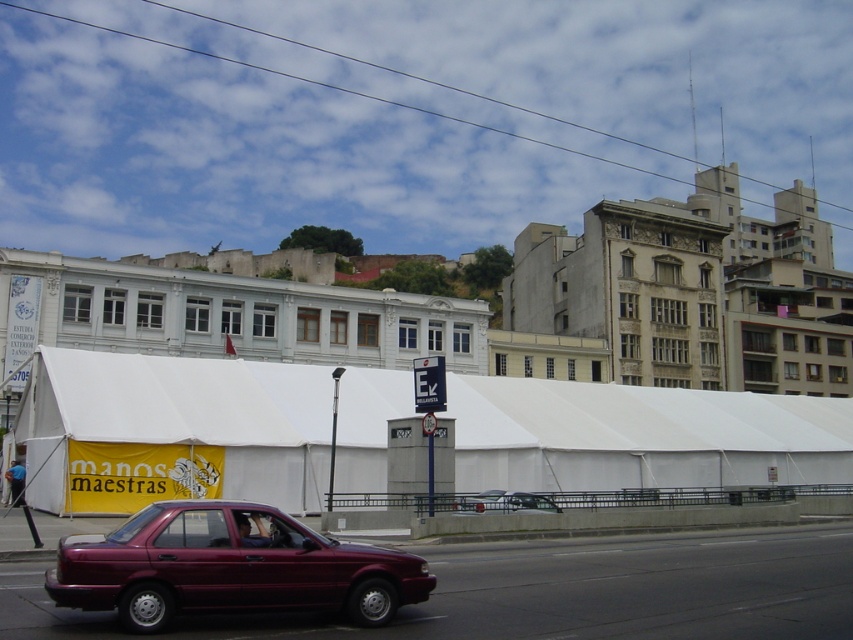
You are standing at the point with coordinates point (599, 429) and want to walk towards the point with coordinates point (526, 499). Which direction should you move in relation to the maroon sedan driving past the tent?

You should move towards the direction of the maroon sedan driving past the tent because point (599, 429) is behind point (526, 499).